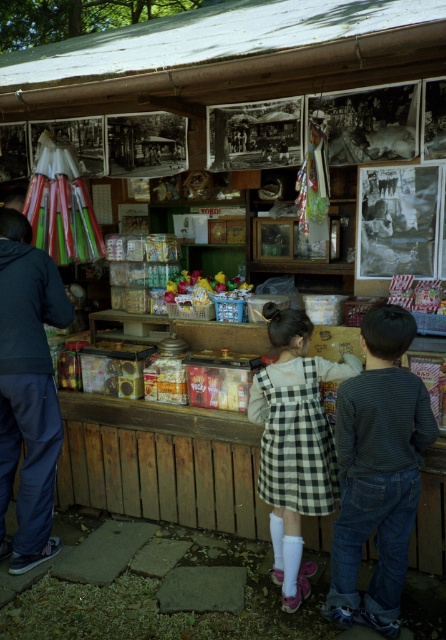
Does striped long-sleeve shirt at center have a lesser width compared to dark blue fabric at left?

Indeed, striped long-sleeve shirt at center has a lesser width compared to dark blue fabric at left.

Who is more distant from viewer, (383,508) or (16,275)?

Point (16,275)

Locate an element on the screen. This screenshot has height=640, width=446. striped long-sleeve shirt at center is located at coordinates (378, 470).

Locate an element on the screen. dark blue fabric at left is located at coordinates (28, 388).

Can you confirm if dark blue fabric at left is taller than checkered fabric dress at center?

Indeed, dark blue fabric at left has a greater height compared to checkered fabric dress at center.

Is point (7, 332) positioned after point (326, 476)?

Yes, point (7, 332) is farther from viewer.

This screenshot has height=640, width=446. Identify the location of dark blue fabric at left. (28, 388).

Which is more to the right, striped long-sleeve shirt at center or checkered fabric dress at center?

striped long-sleeve shirt at center

Is striped long-sleeve shirt at center above checkered fabric dress at center?

Incorrect, striped long-sleeve shirt at center is not positioned above checkered fabric dress at center.

This screenshot has width=446, height=640. Describe the element at coordinates (378, 470) in the screenshot. I see `striped long-sleeve shirt at center` at that location.

Identify the location of striped long-sleeve shirt at center. This screenshot has height=640, width=446. (378, 470).